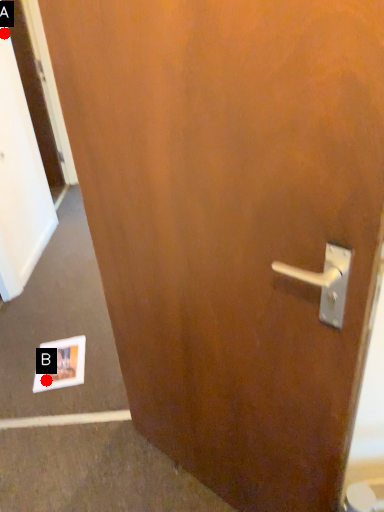
Question: Two points are circled on the image, labeled by A and B beside each circle. Which of the following is the closest to the observer?

Choices:
 (A) A is closer
 (B) B is closer

Answer: (B)